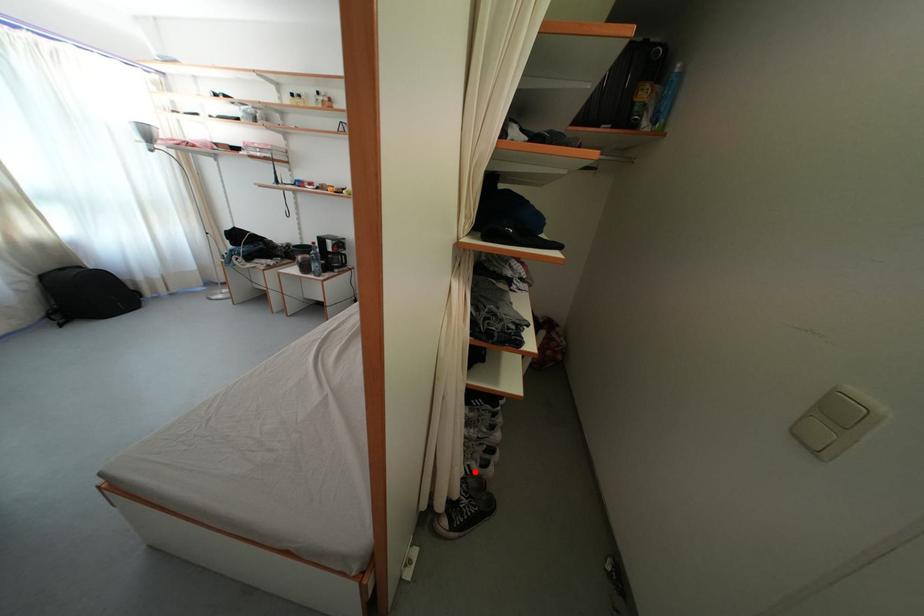
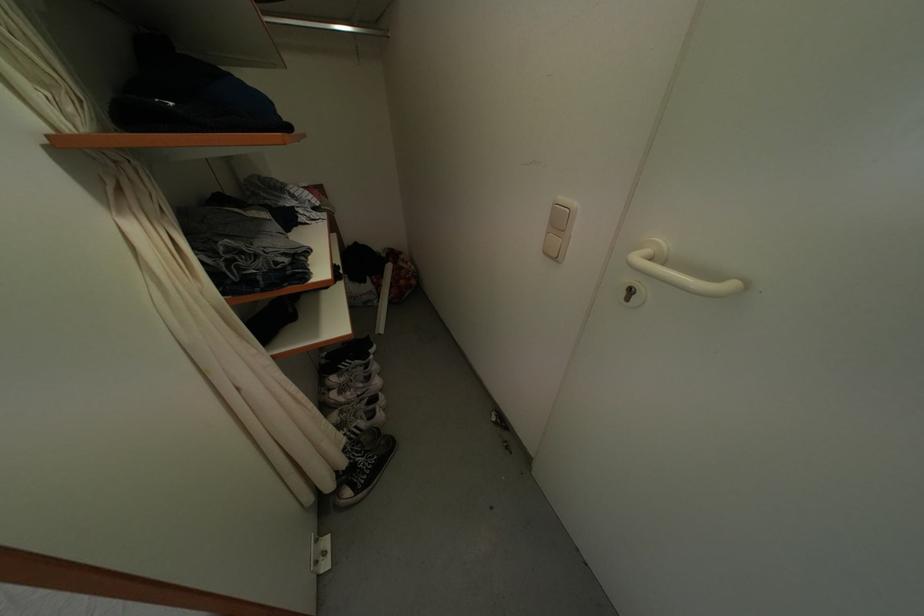
The point at the highlighted location is marked in the first image. Where is the corresponding point in the second image?

(361, 432)